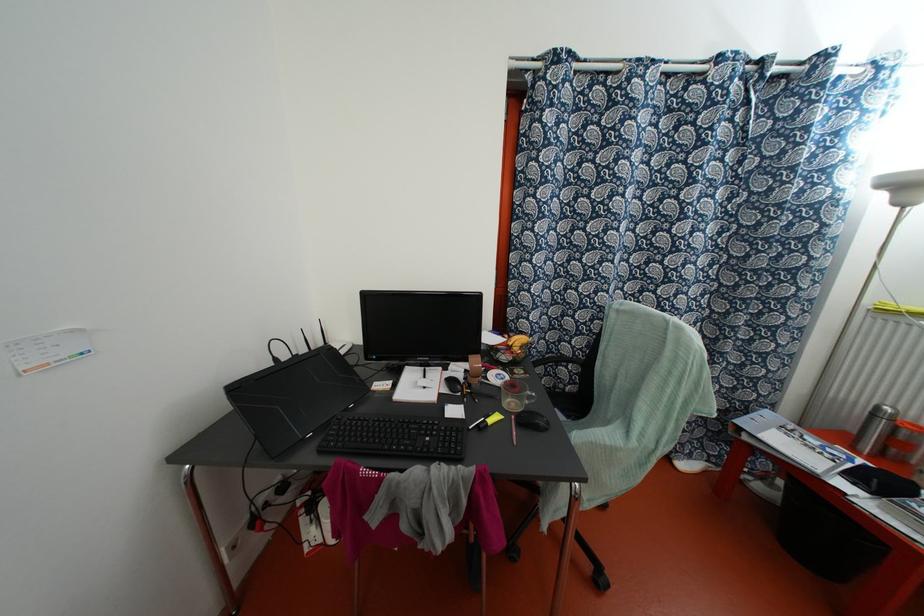
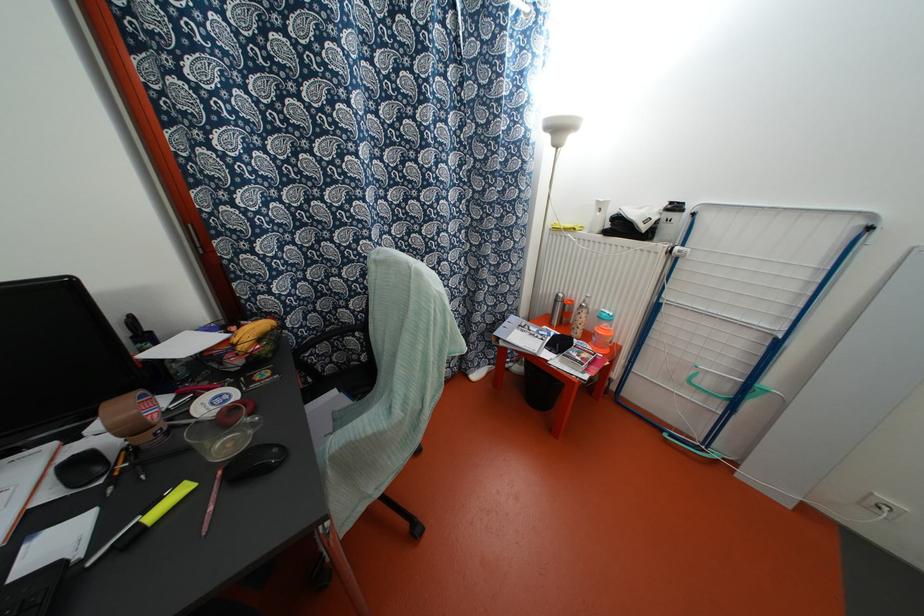
In the second image, find the point that corresponds to (872,415) in the first image.

(554, 301)